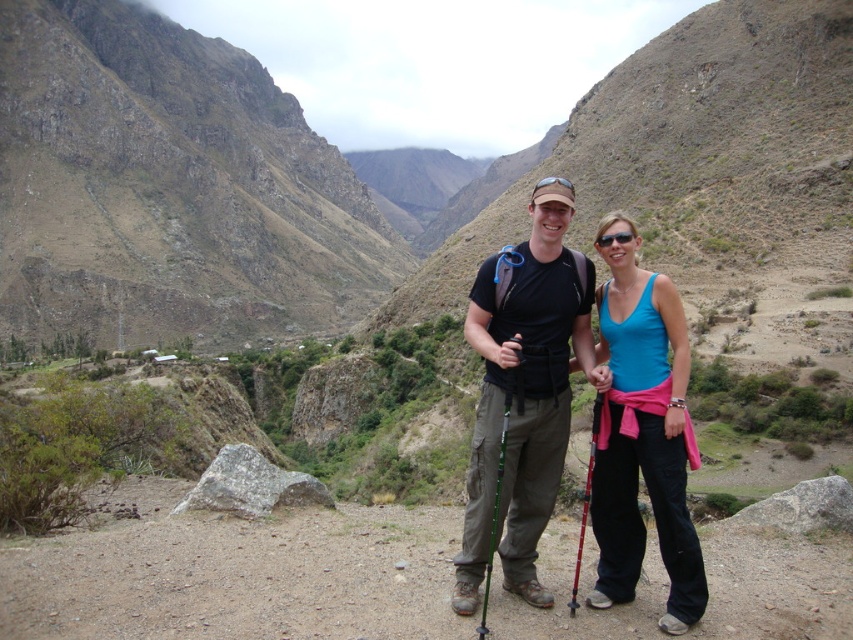
Question: Which point is farther from the camera taking this photo?

Choices:
 (A) (500, 474)
 (B) (611, 241)

Answer: (B)

Question: Considering the relative positions of green textured pole at center and pink plastic ski pole at center-right in the image provided, where is green textured pole at center located with respect to pink plastic ski pole at center-right?

Choices:
 (A) below
 (B) above

Answer: (A)

Question: Which of the following is the closest to the observer?

Choices:
 (A) pink plastic ski pole at center-right
 (B) green textured pole at center

Answer: (B)

Question: Where is matte black backpack at center located in relation to green textured pole at center in the image?

Choices:
 (A) left
 (B) right

Answer: (B)

Question: Estimate the real-world distances between objects in this image. Which object is farther from the dull brown rock at upper left?

Choices:
 (A) matte black backpack at center
 (B) black plastic sunglasses at center
 (C) pink plastic ski pole at center-right

Answer: (B)

Question: Can you confirm if matte black backpack at center is positioned below green textured pole at center?

Choices:
 (A) no
 (B) yes

Answer: (A)